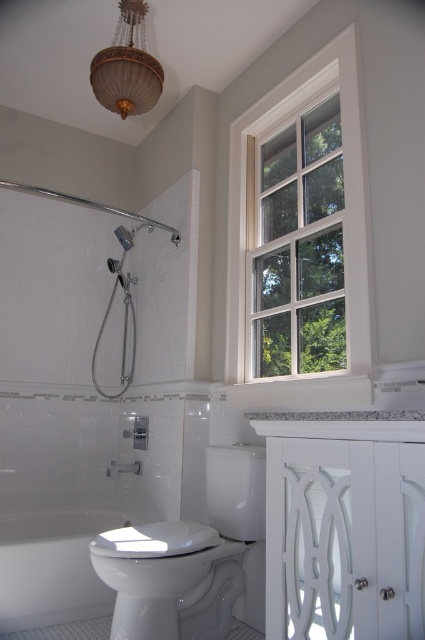
Question: Which object is the closest to the white glossy bathtub at lower left?

Choices:
 (A) white wood window at upper right
 (B) matte silver shower head at upper left
 (C) white glossy toilet bowl at lower center
 (D) gold textured lampshade at upper center

Answer: (C)

Question: Can you confirm if gold textured lampshade at upper center is wider than matte silver shower head at upper left?

Choices:
 (A) yes
 (B) no

Answer: (A)

Question: Can you confirm if white glossy bathtub at lower left is smaller than matte silver shower head at upper left?

Choices:
 (A) no
 (B) yes

Answer: (A)

Question: Among these objects, which one is nearest to the camera?

Choices:
 (A) white glossy toilet bowl at lower center
 (B) white wood window at upper right
 (C) gold textured lampshade at upper center

Answer: (A)

Question: Based on their relative distances, which object is nearer to the gold textured lampshade at upper center?

Choices:
 (A) matte silver shower head at upper left
 (B) white wood window at upper right
 (C) white glossy bathtub at lower left

Answer: (B)

Question: Is white glossy bathtub at lower left closer to camera compared to matte silver shower head at upper left?

Choices:
 (A) no
 (B) yes

Answer: (B)